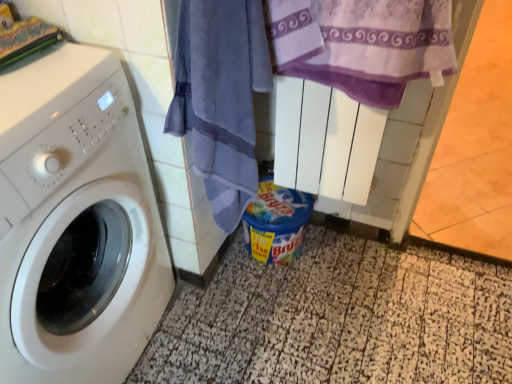
What do you see at coordinates (221, 97) in the screenshot?
I see `blue cotton towel at center, which is counted as the second beach towel, starting from the right` at bounding box center [221, 97].

The width and height of the screenshot is (512, 384). Find the location of `blue plastic container at lower center`. blue plastic container at lower center is located at coordinates (276, 222).

From the picture: Measure the distance between point (144, 187) and camera.

Point (144, 187) and camera are 1.03 meters apart from each other.

Describe the element at coordinates (76, 223) in the screenshot. I see `white glossy washing machine at left` at that location.

Image resolution: width=512 pixels, height=384 pixels. What do you see at coordinates (338, 319) in the screenshot?
I see `speckled tile at lower center` at bounding box center [338, 319].

I want to click on blue cotton towel at center, which is counted as the second beach towel, starting from the right, so click(221, 97).

From the image's perspective, would you say speckled tile at lower center is shown under blue cotton towel at center, which is counted as the second beach towel, starting from the right?

Indeed, from the image's perspective, speckled tile at lower center is shown beneath blue cotton towel at center, which is counted as the second beach towel, starting from the right.

From a real-world perspective, relative to blue cotton towel at center, which is counted as the second beach towel, starting from the right, is speckled tile at lower center vertically above or below?

Clearly, from a real-world perspective, speckled tile at lower center is below blue cotton towel at center, which is counted as the second beach towel, starting from the right.

Based on the photo, between speckled tile at lower center and blue cotton towel at center, the first beach towel from the left, which one has smaller size?

blue cotton towel at center, the first beach towel from the left, is smaller.

Is speckled tile at lower center directly adjacent to blue cotton towel at center, the first beach towel from the left?

No.

Could you tell me if purple textured towel at upper right, which is counted as the first beach towel, starting from the right, is turned towards blue plastic container at lower center?

No, purple textured towel at upper right, which is counted as the first beach towel, starting from the right, does not turn towards blue plastic container at lower center.

From a real-world perspective, which is physically above, purple textured towel at upper right, which is counted as the first beach towel, starting from the right, or blue plastic container at lower center?

In real-world perspective, purple textured towel at upper right, which is counted as the first beach towel, starting from the right, is above.

Considering their positions, is purple textured towel at upper right, the second beach towel from the left, located in front of or behind blue plastic container at lower center?

purple textured towel at upper right, the second beach towel from the left, is positioned closer to the viewer than blue plastic container at lower center.

Considering the relative sizes of blue plastic container at lower center and white glossy washing machine at left in the image provided, is blue plastic container at lower center bigger than white glossy washing machine at left?

Actually, blue plastic container at lower center might be smaller than white glossy washing machine at left.

How far apart are blue plastic container at lower center and white glossy washing machine at left?

22.88 inches.

In terms of width, does blue plastic container at lower center look wider or thinner when compared to white glossy washing machine at left?

In the image, blue plastic container at lower center appears to be more narrow than white glossy washing machine at left.

From the image's perspective, which one is positioned higher, blue plastic container at lower center or white glossy washing machine at left?

blue plastic container at lower center is shown above in the image.

Considering the positions of points (261, 60) and (124, 163), is point (261, 60) farther from camera compared to point (124, 163)?

No, (261, 60) is in front of (124, 163).

From a real-world perspective, is blue cotton towel at center, the first beach towel from the left, above or below white glossy washing machine at left?

Clearly, from a real-world perspective, blue cotton towel at center, the first beach towel from the left, is above white glossy washing machine at left.

Is blue cotton towel at center, the first beach towel from the left, oriented towards white glossy washing machine at left?

No, blue cotton towel at center, the first beach towel from the left, does not turn towards white glossy washing machine at left.

Is blue plastic container at lower center positioned with its back to blue cotton towel at center, which is counted as the second beach towel, starting from the right?

blue plastic container at lower center does not have its back to blue cotton towel at center, which is counted as the second beach towel, starting from the right.

From the image's perspective, is blue plastic container at lower center under blue cotton towel at center, the first beach towel from the left?

Correct, blue plastic container at lower center appears lower than blue cotton towel at center, the first beach towel from the left, in the image.

Considering the positions of objects blue plastic container at lower center and blue cotton towel at center, which is counted as the second beach towel, starting from the right, in the image provided, who is behind, blue plastic container at lower center or blue cotton towel at center, which is counted as the second beach towel, starting from the right,?

blue plastic container at lower center is more distant.

Is purple textured towel at upper right, the second beach towel from the left, wider or thinner than speckled tile at lower center?

purple textured towel at upper right, the second beach towel from the left, is thinner than speckled tile at lower center.

Who is shorter, purple textured towel at upper right, which is counted as the first beach towel, starting from the right, or speckled tile at lower center?

With less height is speckled tile at lower center.

Looking at the image, does purple textured towel at upper right, which is counted as the first beach towel, starting from the right, seem bigger or smaller compared to speckled tile at lower center?

purple textured towel at upper right, which is counted as the first beach towel, starting from the right, is smaller than speckled tile at lower center.

Considering the relative positions of purple textured towel at upper right, the second beach towel from the left, and speckled tile at lower center in the image provided, is purple textured towel at upper right, the second beach towel from the left, to the left of speckled tile at lower center from the viewer's perspective?

Correct, you'll find purple textured towel at upper right, the second beach towel from the left, to the left of speckled tile at lower center.

Is the depth of white glossy washing machine at left greater than that of blue cotton towel at center, which is counted as the second beach towel, starting from the right?

No, white glossy washing machine at left is closer to the camera.

Looking at their sizes, would you say white glossy washing machine at left is wider or thinner than blue cotton towel at center, the first beach towel from the left?

white glossy washing machine at left is wider than blue cotton towel at center, the first beach towel from the left.

Is white glossy washing machine at left oriented away from blue cotton towel at center, the first beach towel from the left?

No, white glossy washing machine at left is not facing the opposite direction of blue cotton towel at center, the first beach towel from the left.

Is point (92, 171) positioned before point (268, 81)?

Yes, it is in front of point (268, 81).

The width and height of the screenshot is (512, 384). Find the location of `tile below the blue cotton towel at center, the first beach towel from the left (from a real-world perspective)`. tile below the blue cotton towel at center, the first beach towel from the left (from a real-world perspective) is located at coordinates (338, 319).

The width and height of the screenshot is (512, 384). In order to click on garbage behind the purple textured towel at upper right, the second beach towel from the left in this screenshot , I will do `click(276, 222)`.

Considering their positions, is speckled tile at lower center positioned closer to blue cotton towel at center, which is counted as the second beach towel, starting from the right, than white glossy washing machine at left?

The object closer to blue cotton towel at center, which is counted as the second beach towel, starting from the right, is white glossy washing machine at left.

Estimate the real-world distances between objects in this image. Which object is further from blue plastic container at lower center, speckled tile at lower center or purple textured towel at upper right, the second beach towel from the left?

Based on the image, purple textured towel at upper right, the second beach towel from the left, appears to be further to blue plastic container at lower center.

Considering their positions, is blue plastic container at lower center positioned further to blue cotton towel at center, the first beach towel from the left, than speckled tile at lower center?

Based on the image, speckled tile at lower center appears to be further to blue cotton towel at center, the first beach towel from the left.

Considering their positions, is speckled tile at lower center positioned further to blue cotton towel at center, the first beach towel from the left, than blue plastic container at lower center?

speckled tile at lower center.

From the picture: Which object lies further to the anchor point blue cotton towel at center, which is counted as the second beach towel, starting from the right, speckled tile at lower center or purple textured towel at upper right, which is counted as the first beach towel, starting from the right?

speckled tile at lower center.

Considering their positions, is blue cotton towel at center, the first beach towel from the left, positioned further to blue plastic container at lower center than purple textured towel at upper right, the second beach towel from the left?

purple textured towel at upper right, the second beach towel from the left, lies further to blue plastic container at lower center than the other object.

When comparing their distances from blue cotton towel at center, the first beach towel from the left, does blue plastic container at lower center or purple textured towel at upper right, which is counted as the first beach towel, starting from the right, seem closer?

purple textured towel at upper right, which is counted as the first beach towel, starting from the right, lies closer to blue cotton towel at center, the first beach towel from the left, than the other object.

Considering their positions, is blue cotton towel at center, which is counted as the second beach towel, starting from the right, positioned further to speckled tile at lower center than white glossy washing machine at left?

Among the two, blue cotton towel at center, which is counted as the second beach towel, starting from the right, is located further to speckled tile at lower center.

This screenshot has height=384, width=512. Find the location of `tile between blue cotton towel at center, the first beach towel from the left, and blue plastic container at lower center from front to back`. tile between blue cotton towel at center, the first beach towel from the left, and blue plastic container at lower center from front to back is located at coordinates (338, 319).

Find the location of a particular element. garbage between purple textured towel at upper right, the second beach towel from the left, and speckled tile at lower center, in the vertical direction is located at coordinates (276, 222).

Locate an element on the screen. The image size is (512, 384). beach towel between blue cotton towel at center, the first beach towel from the left, and blue plastic container at lower center, along the z-axis is located at coordinates (362, 44).

Where is `beach towel between purple textured towel at upper right, the second beach towel from the left, and speckled tile at lower center from top to bottom`? beach towel between purple textured towel at upper right, the second beach towel from the left, and speckled tile at lower center from top to bottom is located at coordinates (221, 97).